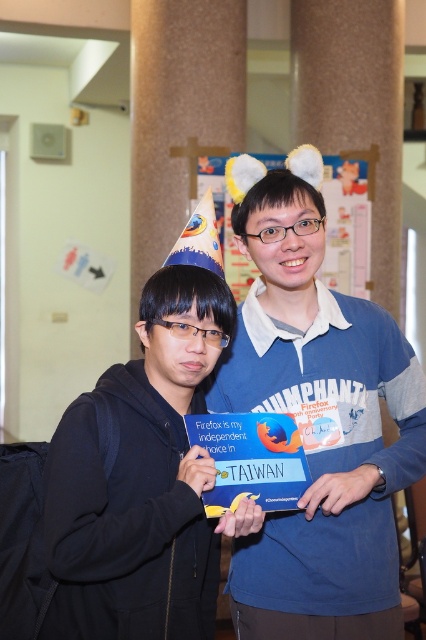
You are at a party and want to take a photo of both the blue fabric shirt at center and the black matte jacket at center. However, you can only focus on one person at a time. Which one should you focus on to ensure the other is still visible in the background?

You should focus on the blue fabric shirt at center because the black matte jacket at center is behind it, making it visible in the background.

You are organizing a clothing donation drive and need to determine which clothing item takes up more space in the donation box. Based on the image, which item between the blue fabric shirt at center and the black matte jacket at center would require more space?

The blue fabric shirt at center is bigger than the black matte jacket at center, so it would require more space in the donation box.

You are organizing a photo shoot and need to arrange two models wearing the blue fabric shirt at center and the black matte jacket at center. Based on their heights, which model should stand in front to ensure both are visible in the photo?

The blue fabric shirt at center is taller than the black matte jacket at center, so the model wearing the black matte jacket at center should stand in front to ensure both are visible in the photo.